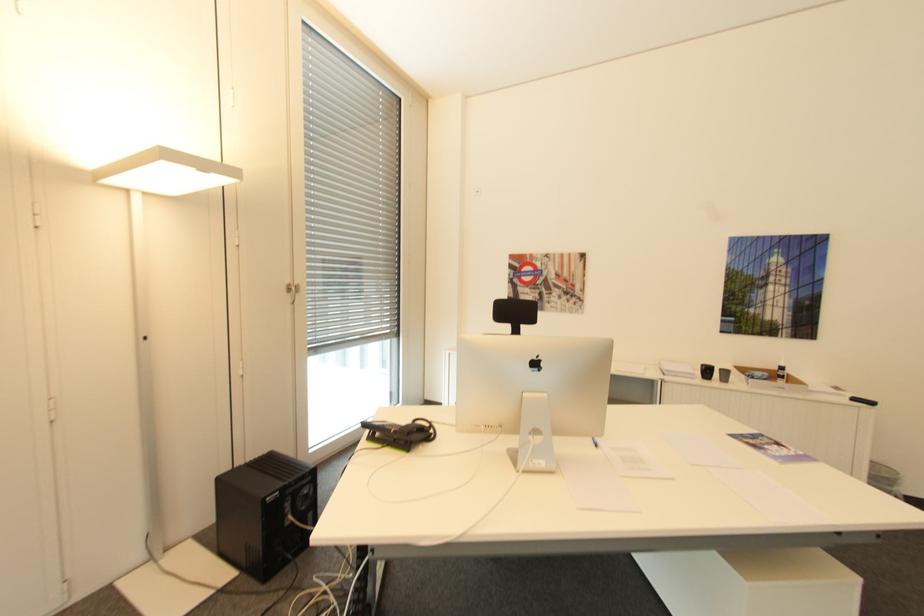
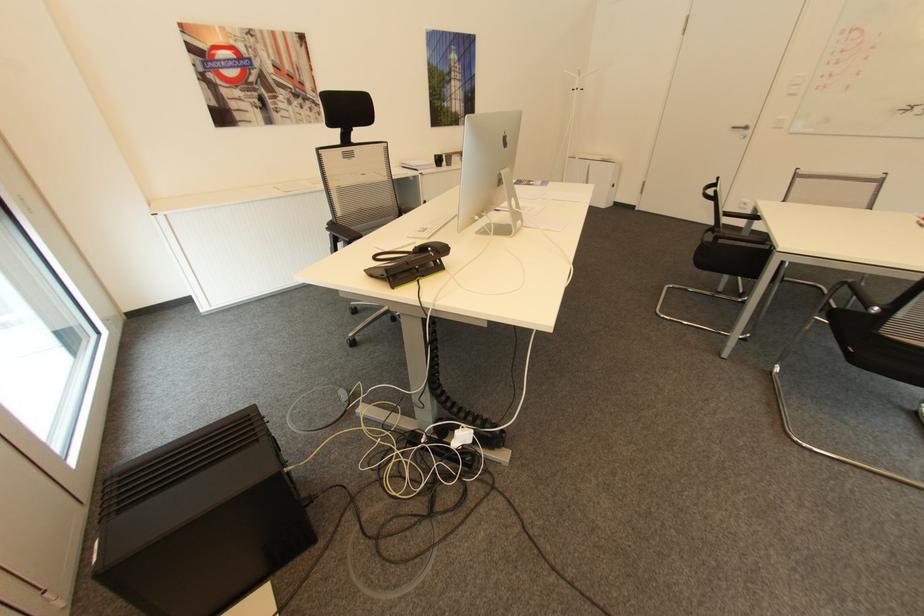
Where in the second image is the point corresponding to the point at 586,299 from the first image?

(322, 102)